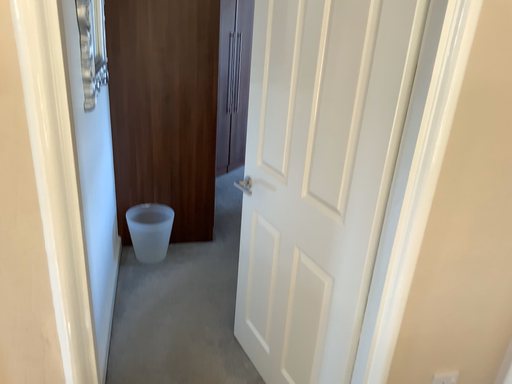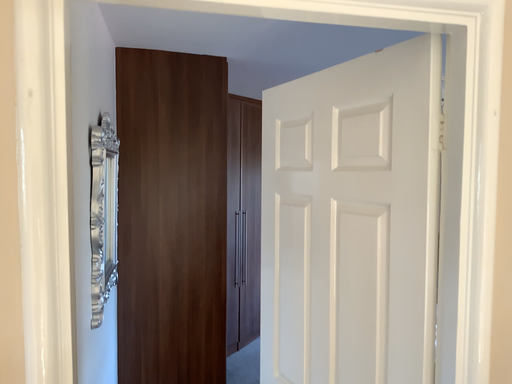
Question: Which way did the camera rotate in the video?

Choices:
 (A) rotated upward
 (B) rotated downward

Answer: (A)